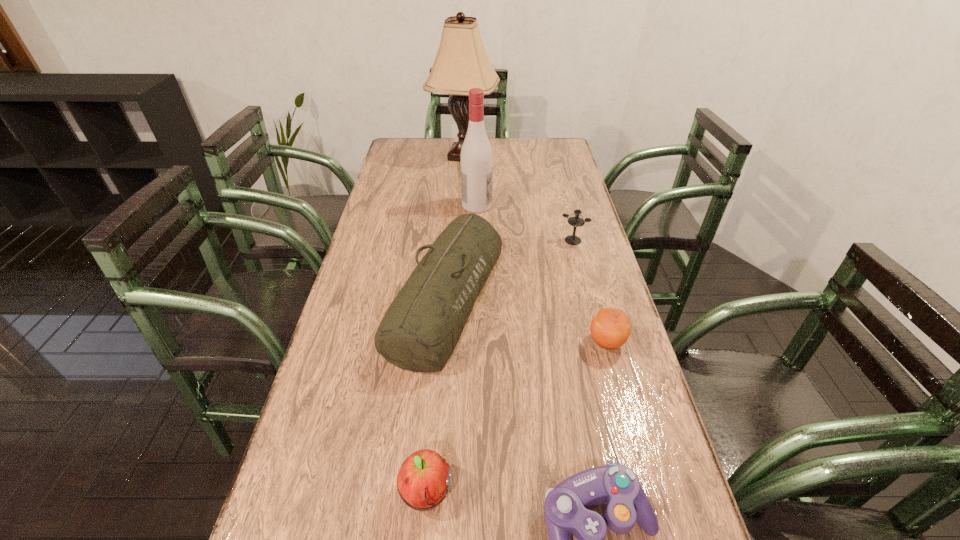
Locate an element on the screen. The height and width of the screenshot is (540, 960). the tallest object is located at coordinates [x=461, y=63].

This screenshot has height=540, width=960. Identify the location of the farthest object. (461, 63).

This screenshot has height=540, width=960. I want to click on alcohol, so click(476, 158).

Locate an element on the screen. the sixth nearest object is located at coordinates (476, 158).

Where is `duffel bag`? The width and height of the screenshot is (960, 540). duffel bag is located at coordinates (421, 328).

Where is `candle holder`? The width and height of the screenshot is (960, 540). candle holder is located at coordinates (576, 221).

Locate an element on the screen. This screenshot has height=540, width=960. apple is located at coordinates (424, 479).

Where is `orange`? orange is located at coordinates (610, 328).

The image size is (960, 540). I want to click on vacant space located 0.190m on the front of the tallest object, so click(x=462, y=198).

At what (x,y) coordinates should I click in order to perform the action: click on vacant space located 0.340m on the label of the sixth nearest object. Please return your answer as a coordinate pair (x, y). Looking at the image, I should click on (588, 205).